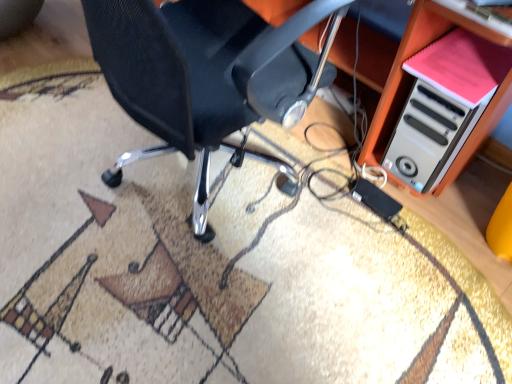
Question: Is black mesh chair at center at the left side of white plastic computer case at lower right?

Choices:
 (A) no
 (B) yes

Answer: (B)

Question: Would you say black mesh chair at center contains white plastic computer case at lower right?

Choices:
 (A) no
 (B) yes

Answer: (A)

Question: Are black mesh chair at center and white plastic computer case at lower right far apart?

Choices:
 (A) no
 (B) yes

Answer: (A)

Question: Are black mesh chair at center and white plastic computer case at lower right beside each other?

Choices:
 (A) yes
 (B) no

Answer: (B)

Question: Is black mesh chair at center facing towards white plastic computer case at lower right?

Choices:
 (A) no
 (B) yes

Answer: (B)

Question: Choose the correct answer: Is white plastic computer tower at right inside white plastic computer case at lower right or outside it?

Choices:
 (A) inside
 (B) outside

Answer: (A)

Question: From the image's perspective, is white plastic computer tower at right positioned above or below white plastic computer case at lower right?

Choices:
 (A) below
 (B) above

Answer: (A)

Question: In the image, is white plastic computer tower at right positioned in front of or behind white plastic computer case at lower right?

Choices:
 (A) front
 (B) behind

Answer: (B)

Question: Would you say white plastic computer tower at right is to the left or to the right of white plastic computer case at lower right in the picture?

Choices:
 (A) right
 (B) left

Answer: (A)

Question: Considering the positions of point (457, 97) and point (292, 51), is point (457, 97) closer or farther from the camera than point (292, 51)?

Choices:
 (A) farther
 (B) closer

Answer: (B)

Question: Considering the relative positions of pink matte book at upper right and black mesh chair at center in the image provided, is pink matte book at upper right to the left or to the right of black mesh chair at center?

Choices:
 (A) left
 (B) right

Answer: (B)

Question: Is pink matte book at upper right inside or outside of black mesh chair at center?

Choices:
 (A) outside
 (B) inside

Answer: (A)

Question: From a real-world perspective, is pink matte book at upper right physically located above or below black mesh chair at center?

Choices:
 (A) above
 (B) below

Answer: (A)

Question: From the image's perspective, is white plastic computer case at lower right above or below black mesh chair at center?

Choices:
 (A) above
 (B) below

Answer: (A)

Question: In the image, is white plastic computer case at lower right positioned in front of or behind black mesh chair at center?

Choices:
 (A) behind
 (B) front

Answer: (A)